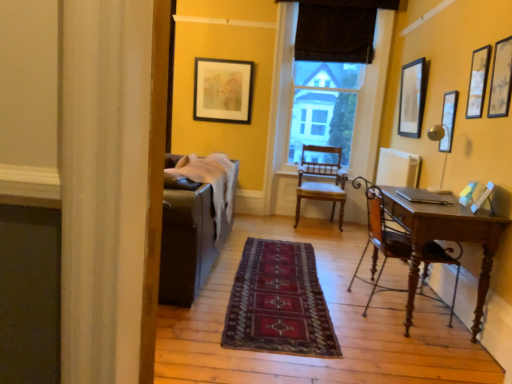
Identify the location of free spot below dark red woven rug at center (from a real-world perspective). The image size is (512, 384). (283, 266).